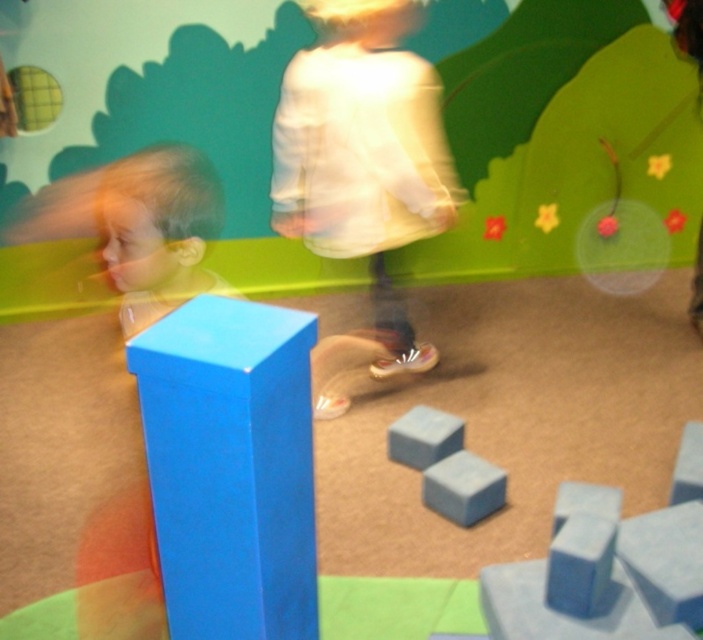
You are a child trying to reach the smooth gray cube at center. There is a blue matte block at center in your way. Can you move around it to get to the cube?

The blue matte block at center is in front of the smooth gray cube at center, so you can move around it to reach the cube.

You are a parent trying to assemble a toy set for your child. The instructions say to place the matte blue cube at center to the left of the blue matte block at center. Based on the image provided, does the current arrangement match the instructions?

Yes, the current arrangement matches the instructions because the matte blue cube at center is positioned on the left side of the blue matte block at center as required.